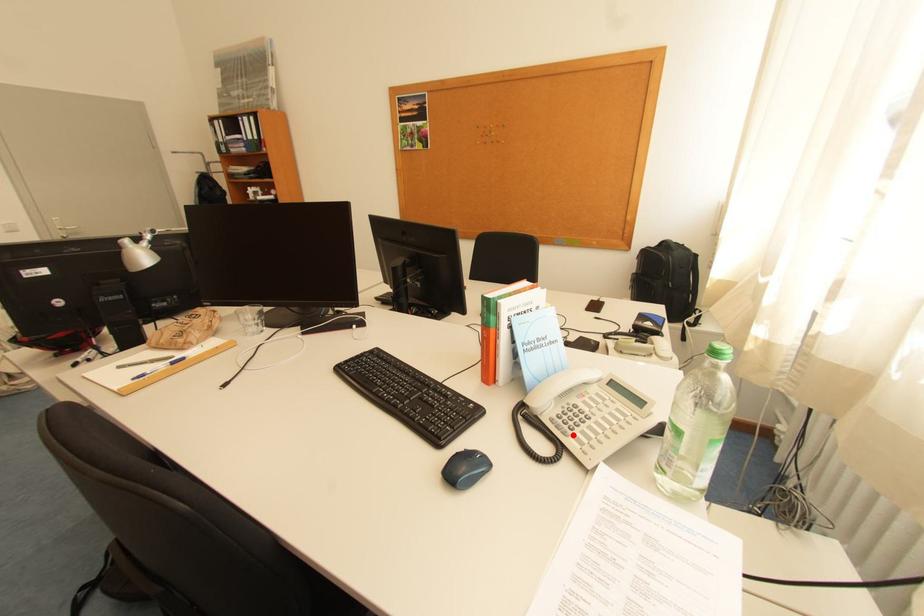
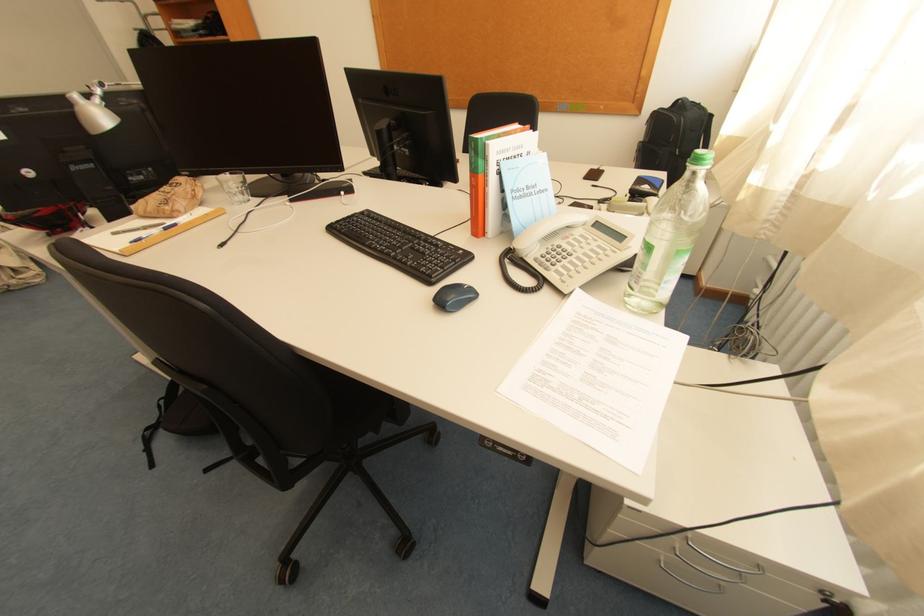
Where in the second image is the point corresponding to the highlighted location from the first image?

(554, 270)